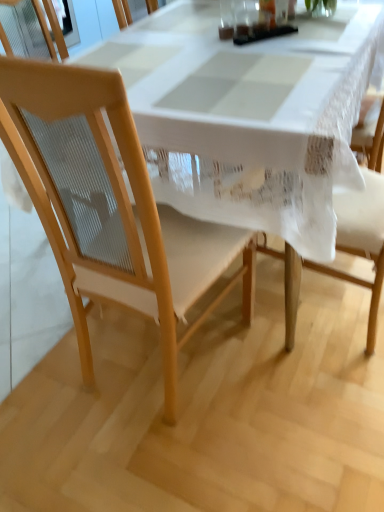
Question: Is light wood chair at center wider than white lace tablecloth at center?

Choices:
 (A) no
 (B) yes

Answer: (A)

Question: Considering the relative sizes of light wood chair at center and white lace tablecloth at center in the image provided, is light wood chair at center shorter than white lace tablecloth at center?

Choices:
 (A) yes
 (B) no

Answer: (B)

Question: From a real-world perspective, is light wood chair at center on white lace tablecloth at center?

Choices:
 (A) yes
 (B) no

Answer: (A)

Question: From the image's perspective, does light wood chair at center appear lower than white lace tablecloth at center?

Choices:
 (A) yes
 (B) no

Answer: (A)

Question: Is light wood chair at center looking in the opposite direction of white lace tablecloth at center?

Choices:
 (A) yes
 (B) no

Answer: (B)

Question: From a real-world perspective, is light wood chair at center below white lace tablecloth at center?

Choices:
 (A) yes
 (B) no

Answer: (B)

Question: Is light wood chair at center located within white lace tablecloth at center?

Choices:
 (A) no
 (B) yes

Answer: (B)

Question: Does white lace tablecloth at center have a lesser height compared to light wood chair at center?

Choices:
 (A) no
 (B) yes

Answer: (B)

Question: Can you confirm if white lace tablecloth at center is thinner than light wood chair at center?

Choices:
 (A) yes
 (B) no

Answer: (B)

Question: From a real-world perspective, is white lace tablecloth at center physically above light wood chair at center?

Choices:
 (A) no
 (B) yes

Answer: (A)

Question: Is white lace tablecloth at center at the right side of light wood chair at center?

Choices:
 (A) no
 (B) yes

Answer: (B)

Question: Could you tell me if white lace tablecloth at center is facing light wood chair at center?

Choices:
 (A) yes
 (B) no

Answer: (A)

Question: From their relative heights in the image, would you say white lace tablecloth at center is taller or shorter than light wood chair at center?

Choices:
 (A) tall
 (B) short

Answer: (B)